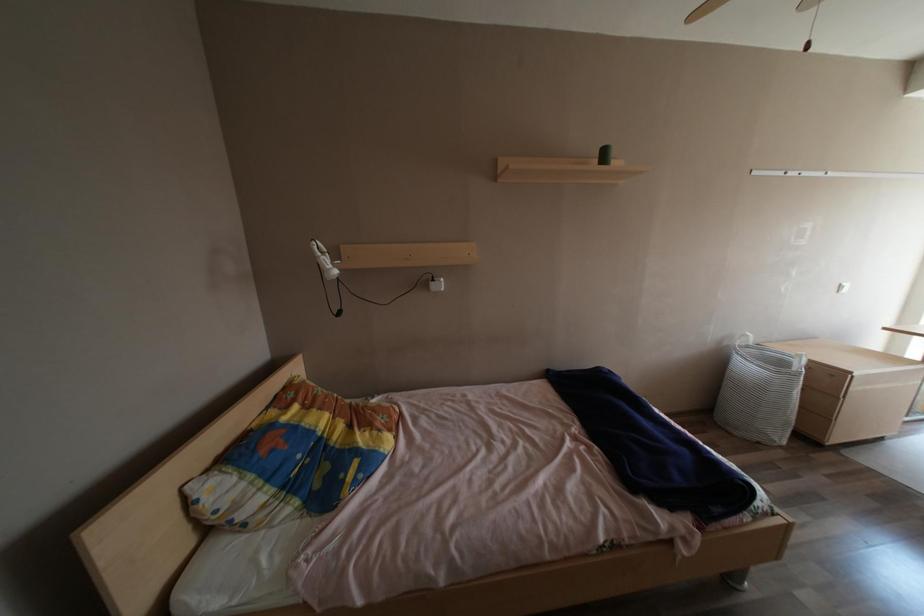
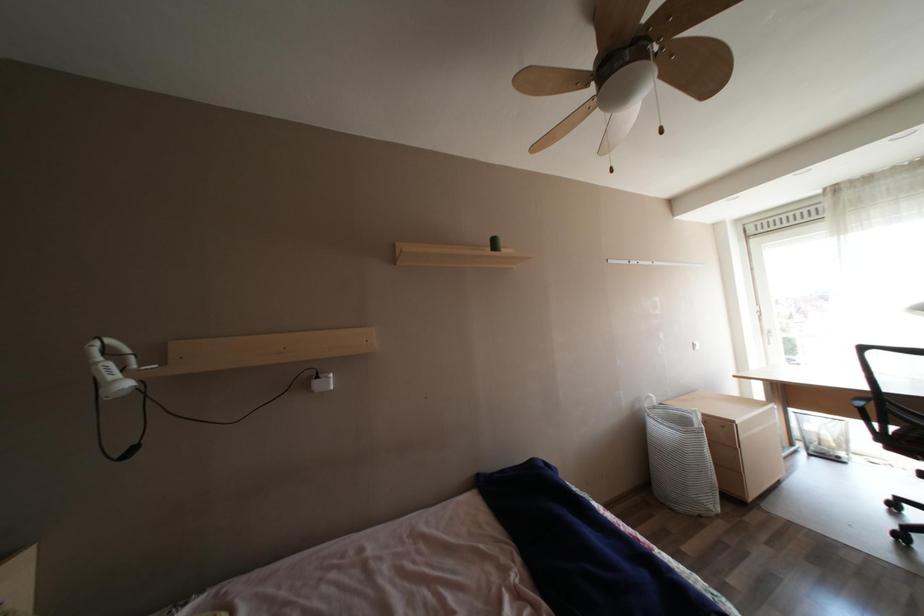
Based on the continuous images, in which direction is the camera rotating?

The camera rotated toward right-up.